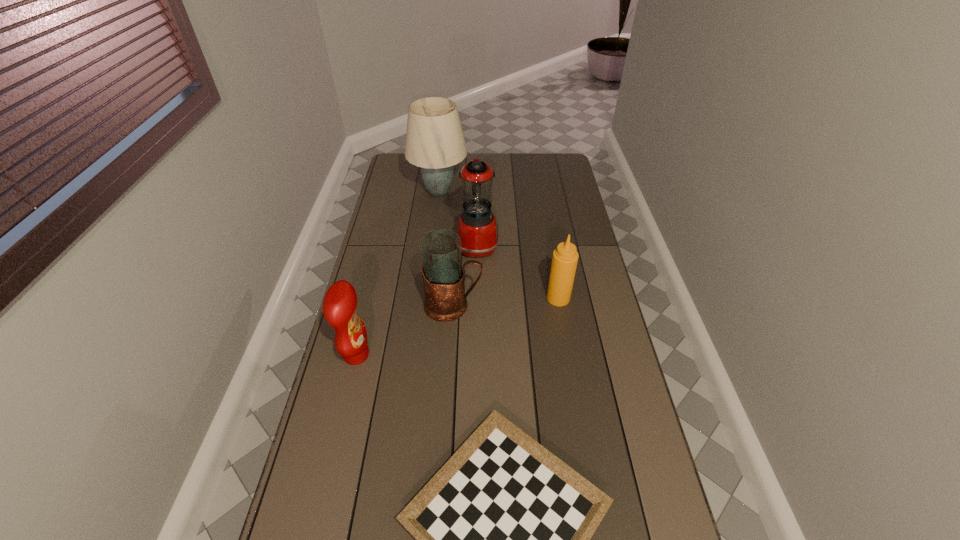
At what (x,y) coordinates should I click in order to perform the action: click on the farthest object. Please return your answer as a coordinate pair (x, y). Image resolution: width=960 pixels, height=540 pixels. Looking at the image, I should click on (435, 142).

Find the location of a particular element. the second farthest object is located at coordinates (477, 227).

Image resolution: width=960 pixels, height=540 pixels. What are the coordinates of `pitcher` in the screenshot? It's located at (443, 276).

Where is `the farther condiment`? The height and width of the screenshot is (540, 960). the farther condiment is located at coordinates (565, 257).

The image size is (960, 540). Identify the location of the leftmost object. (340, 302).

Locate an element on the screen. The image size is (960, 540). the nearer condiment is located at coordinates (340, 302).

Locate an element on the screen. Image resolution: width=960 pixels, height=540 pixels. vacant area situated on the back of the farthest object is located at coordinates (443, 163).

Where is `vacant space situated 0.070m on the controls of the fifth nearest object`? vacant space situated 0.070m on the controls of the fifth nearest object is located at coordinates (516, 246).

Locate an element on the screen. This screenshot has width=960, height=540. free region located with the handle on the side of the pitcher is located at coordinates (566, 306).

Where is `free location located 0.190m on the left of the farther condiment`? The image size is (960, 540). free location located 0.190m on the left of the farther condiment is located at coordinates (494, 298).